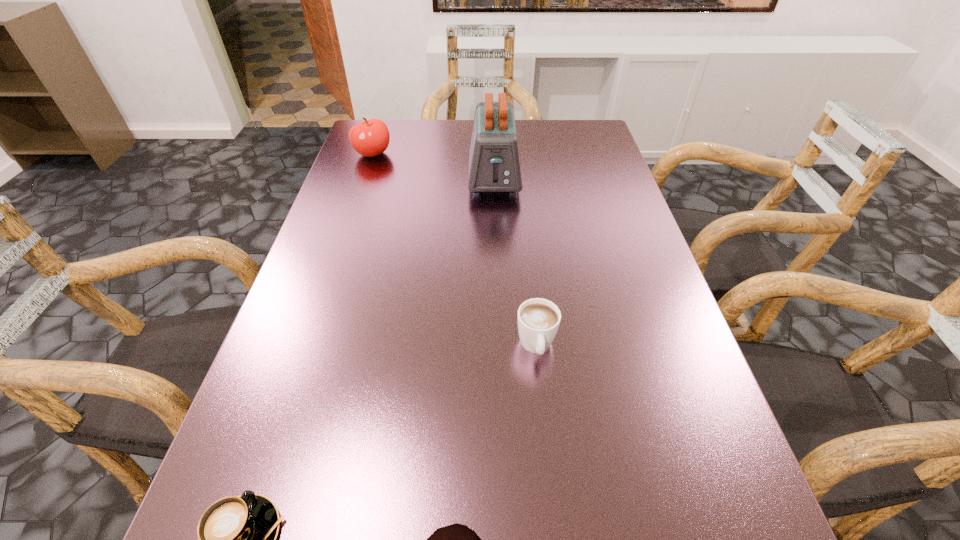
I want to click on object at the far left corner, so click(x=370, y=138).

In the image, there is a desktop. Where is `vacant region at the far edge`? vacant region at the far edge is located at coordinates (453, 142).

The image size is (960, 540). I want to click on vacant space at the left edge of the desktop, so click(325, 252).

Find the location of `vacant space at the right edge of the desktop`. vacant space at the right edge of the desktop is located at coordinates (597, 238).

Find the location of `vacant area at the far right corner`. vacant area at the far right corner is located at coordinates [595, 155].

Image resolution: width=960 pixels, height=540 pixels. Find the location of `vacant area between the apple and the tallest object`. vacant area between the apple and the tallest object is located at coordinates (434, 166).

Point out which object is positioned as the second nearest to the taller cappuccino. Please provide its 2D coordinates. Your answer should be formatted as a tuple, i.e. [(x, y)], where the tuple contains the x and y coordinates of a point satisfying the conditions above.

[(237, 536)]

This screenshot has height=540, width=960. Identify the location of object that is the fourth closest to the toaster. (456, 539).